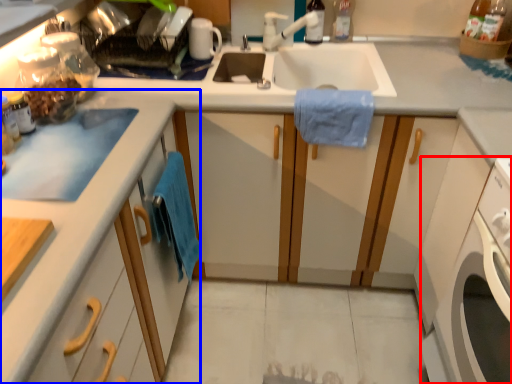
Question: Which object is further to the camera taking this photo, washing machine (highlighted by a red box) or cabinetry (highlighted by a blue box)?

Choices:
 (A) washing machine
 (B) cabinetry

Answer: (A)